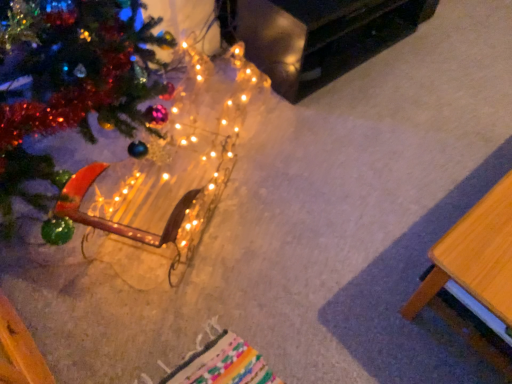
This screenshot has height=384, width=512. Describe the element at coordinates (172, 167) in the screenshot. I see `illuminated wireframe horse at lower left` at that location.

The height and width of the screenshot is (384, 512). What do you see at coordinates (316, 36) in the screenshot?
I see `black glossy table at upper right, which is the first table in top-to-bottom order` at bounding box center [316, 36].

Locate an element on the screen. The width and height of the screenshot is (512, 384). wooden table at lower right, marked as the 1th table in a front-to-back arrangement is located at coordinates (475, 255).

Locate an element on the screen. The image size is (512, 384). illuminated wireframe horse at lower left is located at coordinates (172, 167).

Considering the relative sizes of wooden table at lower right, which is counted as the first table, starting from the bottom, and black glossy table at upper right, which is the first table in top-to-bottom order, in the image provided, is wooden table at lower right, which is counted as the first table, starting from the bottom, taller than black glossy table at upper right, which is the first table in top-to-bottom order,?

Yes, wooden table at lower right, which is counted as the first table, starting from the bottom, is taller than black glossy table at upper right, which is the first table in top-to-bottom order.

Is wooden table at lower right, which is counted as the first table, starting from the bottom, looking in the opposite direction of black glossy table at upper right, the second table in the front-to-back sequence?

Answer: No, black glossy table at upper right, the second table in the front-to-back sequence, is not at the back of wooden table at lower right, which is counted as the first table, starting from the bottom.

In the scene shown: From a real-world perspective, which is physically above, wooden table at lower right, marked as the second table in a back-to-front arrangement, or black glossy table at upper right, the second table in the front-to-back sequence?

In real-world perspective, black glossy table at upper right, the second table in the front-to-back sequence, is above.

Is wooden table at lower right, arranged as the 2th table when viewed from the top, outside of black glossy table at upper right, which is the first table in back-to-front order?

Yes, wooden table at lower right, arranged as the 2th table when viewed from the top, is not within black glossy table at upper right, which is the first table in back-to-front order.

Does illuminated wireframe horse at lower left touch black glossy table at upper right, which is the first table in back-to-front order?

No.

Is illuminated wireframe horse at lower left situated inside black glossy table at upper right, which is the first table in back-to-front order, or outside?

illuminated wireframe horse at lower left is outside black glossy table at upper right, which is the first table in back-to-front order.

Does illuminated wireframe horse at lower left appear on the right side of black glossy table at upper right, the second table in the front-to-back sequence?

In fact, illuminated wireframe horse at lower left is to the left of black glossy table at upper right, the second table in the front-to-back sequence.

Is illuminated wireframe horse at lower left aimed at black glossy table at upper right, which is the first table in top-to-bottom order?

No, illuminated wireframe horse at lower left is not turned towards black glossy table at upper right, which is the first table in top-to-bottom order.

Is wooden table at lower right, arranged as the 2th table when viewed from the top, not close to illuminated wireframe horse at lower left?

No.

Locate an element on the screen. table below the illuminated wireframe horse at lower left (from the image's perspective) is located at coordinates (475, 255).

Which is behind, point (489, 196) or point (146, 230)?

The point (489, 196) is behind.

In terms of width, does wooden table at lower right, which is counted as the first table, starting from the bottom, look wider or thinner when compared to illuminated wireframe horse at lower left?

wooden table at lower right, which is counted as the first table, starting from the bottom, is thinner than illuminated wireframe horse at lower left.

Looking at the image, does black glossy table at upper right, which is counted as the 2th table, starting from the bottom, seem bigger or smaller compared to illuminated wireframe horse at lower left?

In the image, black glossy table at upper right, which is counted as the 2th table, starting from the bottom, appears to be smaller than illuminated wireframe horse at lower left.

Considering the relative positions of black glossy table at upper right, which is the first table in back-to-front order, and illuminated wireframe horse at lower left in the image provided, is black glossy table at upper right, which is the first table in back-to-front order, to the right of illuminated wireframe horse at lower left from the viewer's perspective?

Yes, black glossy table at upper right, which is the first table in back-to-front order, is to the right of illuminated wireframe horse at lower left.

Looking at this image, considering the sizes of black glossy table at upper right, which is counted as the 2th table, starting from the bottom, and illuminated wireframe horse at lower left in the image, is black glossy table at upper right, which is counted as the 2th table, starting from the bottom, wider or thinner than illuminated wireframe horse at lower left?

Considering their sizes, black glossy table at upper right, which is counted as the 2th table, starting from the bottom, looks slimmer than illuminated wireframe horse at lower left.

Between point (246, 56) and point (145, 218), which one is positioned behind?

The point (246, 56) is farther.

Locate an element on the screen. The height and width of the screenshot is (384, 512). christmas decoration on the left of wooden table at lower right, marked as the second table in a back-to-front arrangement is located at coordinates (172, 167).

Does illuminated wireframe horse at lower left turn towards wooden table at lower right, which is counted as the first table, starting from the bottom?

Yes.

Which point is more distant from viewer, (x=184, y=158) or (x=509, y=245)?

The point (x=184, y=158) is farther.

Between illuminated wireframe horse at lower left and wooden table at lower right, marked as the 1th table in a front-to-back arrangement, which one has less height?

illuminated wireframe horse at lower left.

Which point is more forward, (360, 9) or (426, 301)?

The point (426, 301) is closer.

Is black glossy table at upper right, the second table in the front-to-back sequence, touching wooden table at lower right, marked as the 1th table in a front-to-back arrangement?

black glossy table at upper right, the second table in the front-to-back sequence, and wooden table at lower right, marked as the 1th table in a front-to-back arrangement, are not in contact.

At what (x,y) coordinates should I click in order to perform the action: click on table below the black glossy table at upper right, which is the first table in top-to-bottom order (from the image's perspective). Please return your answer as a coordinate pair (x, y). Looking at the image, I should click on (475, 255).

Where is `table above the illuminated wireframe horse at lower left (from the image's perspective)`? Image resolution: width=512 pixels, height=384 pixels. table above the illuminated wireframe horse at lower left (from the image's perspective) is located at coordinates (316, 36).

Estimate the real-world distances between objects in this image. Which object is closer to illuminated wireframe horse at lower left, black glossy table at upper right, which is the first table in back-to-front order, or wooden table at lower right, which is counted as the first table, starting from the bottom?

black glossy table at upper right, which is the first table in back-to-front order, lies closer to illuminated wireframe horse at lower left than the other object.

Estimate the real-world distances between objects in this image. Which object is further from wooden table at lower right, marked as the 1th table in a front-to-back arrangement, illuminated wireframe horse at lower left or black glossy table at upper right, which is counted as the 2th table, starting from the bottom?

The object further to wooden table at lower right, marked as the 1th table in a front-to-back arrangement, is black glossy table at upper right, which is counted as the 2th table, starting from the bottom.

Looking at the image, which one is located further to wooden table at lower right, marked as the second table in a back-to-front arrangement, black glossy table at upper right, which is the first table in top-to-bottom order, or illuminated wireframe horse at lower left?

black glossy table at upper right, which is the first table in top-to-bottom order, is further to wooden table at lower right, marked as the second table in a back-to-front arrangement.

Which object lies nearer to the anchor point black glossy table at upper right, which is the first table in top-to-bottom order, wooden table at lower right, marked as the second table in a back-to-front arrangement, or illuminated wireframe horse at lower left?

illuminated wireframe horse at lower left is positioned closer to the anchor black glossy table at upper right, which is the first table in top-to-bottom order.

In the scene shown: Estimate the real-world distances between objects in this image. Which object is further from black glossy table at upper right, which is the first table in top-to-bottom order, illuminated wireframe horse at lower left or wooden table at lower right, marked as the 1th table in a front-to-back arrangement?

wooden table at lower right, marked as the 1th table in a front-to-back arrangement, is positioned further to the anchor black glossy table at upper right, which is the first table in top-to-bottom order.

Which object lies further to the anchor point illuminated wireframe horse at lower left, wooden table at lower right, marked as the 1th table in a front-to-back arrangement, or black glossy table at upper right, which is the first table in back-to-front order?

wooden table at lower right, marked as the 1th table in a front-to-back arrangement, is positioned further to the anchor illuminated wireframe horse at lower left.

Identify the location of table between illuminated wireframe horse at lower left and wooden table at lower right, arranged as the 2th table when viewed from the top, from left to right. (316, 36).